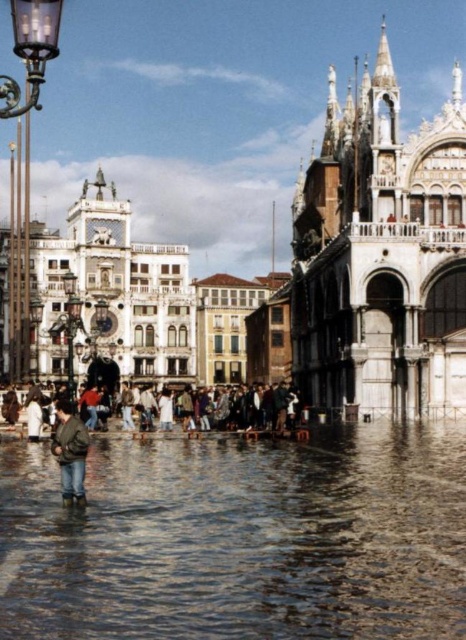
Looking at this image, you are a tourist standing in the flooded square and want to take a photo of the white marble palace at center without the clear water at lower center in the foreground. Is it possible to step back enough to frame the palace without the water appearing in the shot?

The clear water at lower center is wider than the white marble palace at center. Therefore, stepping back might still show the water since it spans a larger area. To avoid the water, you would need to move to higher ground or adjust your angle to exclude the wider water area.